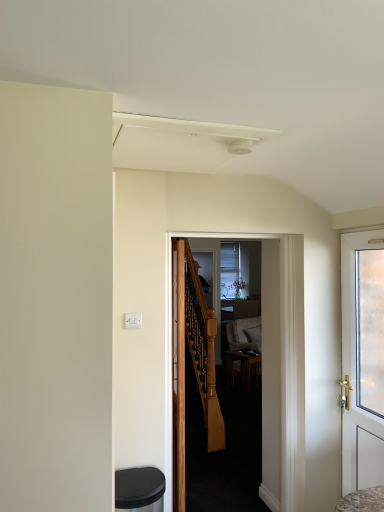
Question: From a real-world perspective, does wooden door at center, the third door viewed from the right, sit lower than brown wooden table at center?

Choices:
 (A) yes
 (B) no

Answer: (B)

Question: Is wooden door at center, the third door viewed from the right, wider than brown wooden table at center?

Choices:
 (A) yes
 (B) no

Answer: (B)

Question: From the image's perspective, is wooden door at center, the third door viewed from the right, on top of brown wooden table at center?

Choices:
 (A) yes
 (B) no

Answer: (A)

Question: Is wooden door at center, which ranks as the 1th door in left-to-right order, facing towards brown wooden table at center?

Choices:
 (A) yes
 (B) no

Answer: (B)

Question: From the image's perspective, is wooden door at center, the third door viewed from the right, below brown wooden table at center?

Choices:
 (A) no
 (B) yes

Answer: (A)

Question: Relative to wooden door at center, the third door viewed from the right, is black plastic music stool at lower left in front or behind?

Choices:
 (A) behind
 (B) front

Answer: (B)

Question: Would you say black plastic music stool at lower left is to the left or to the right of wooden door at center, the third door viewed from the right, in the picture?

Choices:
 (A) left
 (B) right

Answer: (A)

Question: Is black plastic music stool at lower left inside or outside of wooden door at center, which ranks as the 1th door in left-to-right order?

Choices:
 (A) outside
 (B) inside

Answer: (A)

Question: Looking at their shapes, would you say black plastic music stool at lower left is wider or thinner than wooden door at center, which ranks as the 1th door in left-to-right order?

Choices:
 (A) thin
 (B) wide

Answer: (B)

Question: Would you say black plastic music stool at lower left is inside or outside white glossy door at right, which ranks as the 3th door in left-to-right order?

Choices:
 (A) outside
 (B) inside

Answer: (A)

Question: From the image's perspective, relative to white glossy door at right, which is the first door from right to left, is black plastic music stool at lower left above or below?

Choices:
 (A) above
 (B) below

Answer: (B)

Question: Is black plastic music stool at lower left to the left or to the right of white glossy door at right, which is the first door from right to left, in the image?

Choices:
 (A) right
 (B) left

Answer: (B)

Question: Is point (147, 500) positioned closer to the camera than point (344, 237)?

Choices:
 (A) closer
 (B) farther

Answer: (A)

Question: Is point (271, 313) positioned closer to the camera than point (137, 505)?

Choices:
 (A) closer
 (B) farther

Answer: (B)

Question: Considering the positions of wooden door at center, marked as the 2th door in a right-to-left arrangement, and black plastic music stool at lower left in the image, is wooden door at center, marked as the 2th door in a right-to-left arrangement, bigger or smaller than black plastic music stool at lower left?

Choices:
 (A) small
 (B) big

Answer: (B)